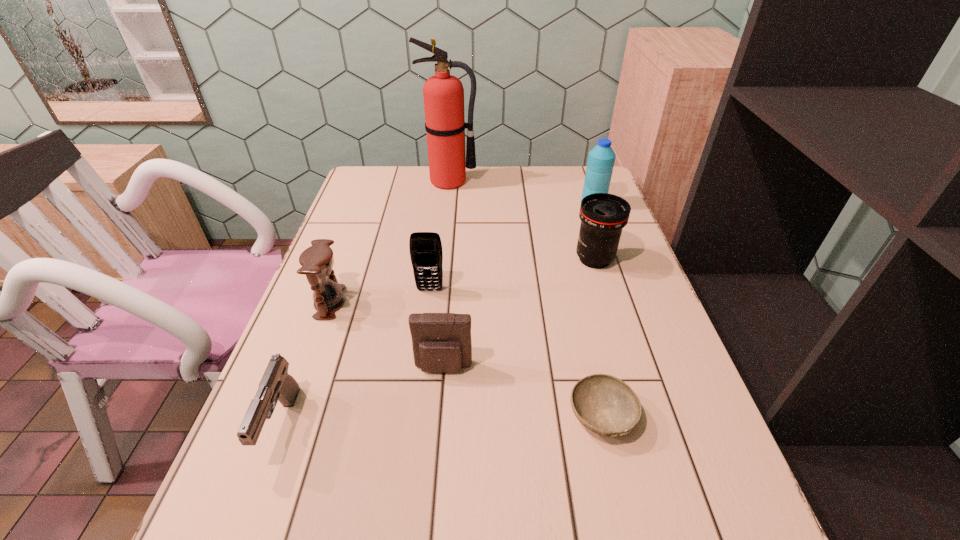
Identify the location of hourglass that is at the left edge. This screenshot has height=540, width=960. (317, 261).

Find the location of a particular element. This screenshot has height=540, width=960. pistol that is at the left edge is located at coordinates (276, 384).

This screenshot has width=960, height=540. I want to click on water bottle that is at the right edge, so click(601, 159).

What are the coordinates of `telephoto lens at the right edge` in the screenshot? It's located at coord(603,216).

I want to click on bowl that is at the right edge, so 606,405.

Image resolution: width=960 pixels, height=540 pixels. What are the coordinates of `object present at the far right corner` in the screenshot? It's located at (601, 159).

Locate an element on the screen. The image size is (960, 540). vacant space at the far edge of the desktop is located at coordinates (546, 178).

In the image, there is a desktop. Where is `free region at the left edge`? The height and width of the screenshot is (540, 960). free region at the left edge is located at coordinates (367, 205).

The image size is (960, 540). In the image, there is a desktop. What are the coordinates of `vacant space at the right edge` in the screenshot? It's located at (660, 461).

Identify the location of vacant space at the far left corner of the desktop. (370, 174).